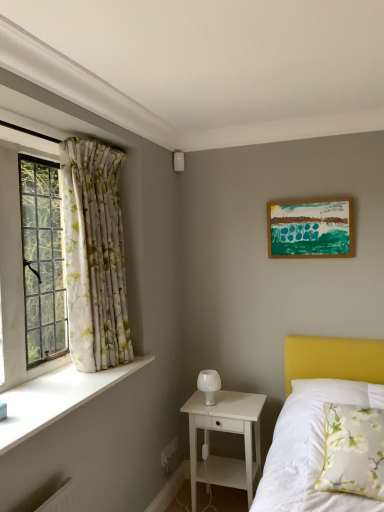
Question: Considering their positions, is wooden picture frame at upper right located in front of or behind floral fabric curtain at left?

Choices:
 (A) front
 (B) behind

Answer: (B)

Question: Is wooden picture frame at upper right spatially inside floral fabric curtain at left, or outside of it?

Choices:
 (A) inside
 (B) outside

Answer: (B)

Question: Which of these objects is positioned closest to the white floral pillow at lower right?

Choices:
 (A) clear glass window at left
 (B) white smooth window sill at left
 (C) floral fabric curtain at left
 (D) white wood nightstand at lower center
 (E) white frosted glass table lamp at center

Answer: (D)

Question: Which is nearer to the white smooth window sill at left?

Choices:
 (A) wooden picture frame at upper right
 (B) white wood nightstand at lower center
 (C) white frosted glass table lamp at center
 (D) clear glass window at left
 (E) white floral pillow at lower right

Answer: (D)